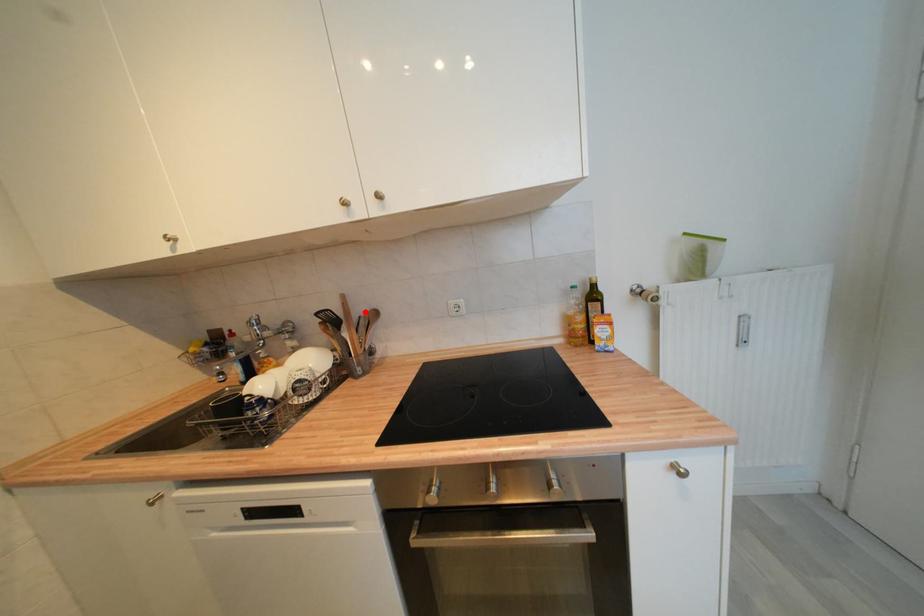
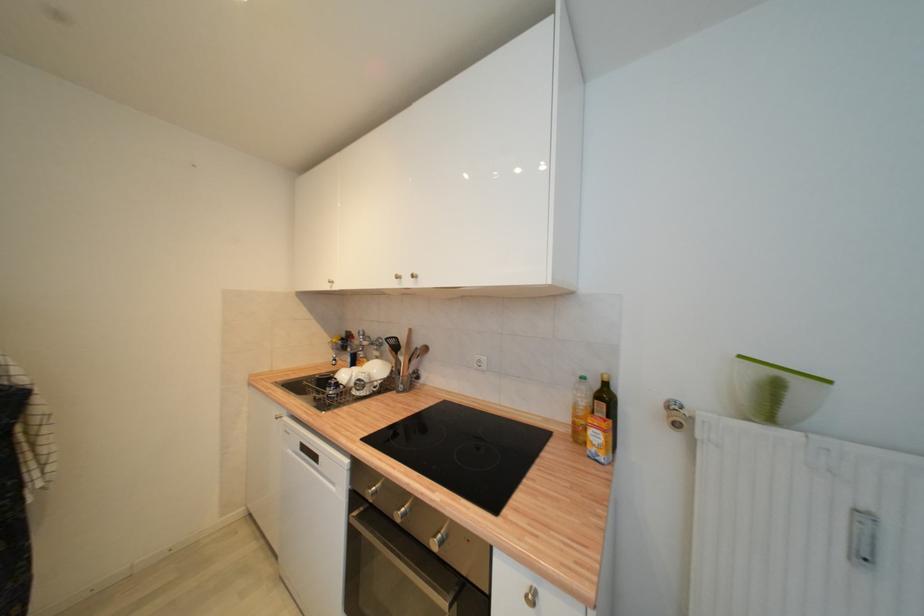
The point at the highlighted location is marked in the first image. Where is the corresponding point in the second image?

(422, 345)